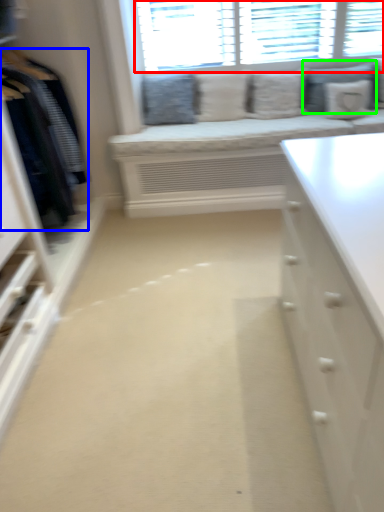
Question: Estimate the real-world distances between objects in this image. Which object is farther from window (highlighted by a red box), clothing (highlighted by a blue box) or pillow (highlighted by a green box)?

Choices:
 (A) clothing
 (B) pillow

Answer: (A)